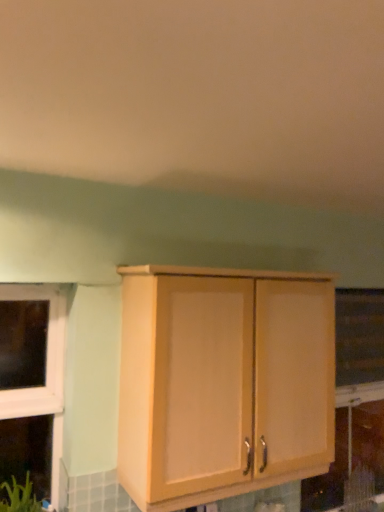
Question: From a real-world perspective, is transparent plastic window screen at right positioned above or below light wood cabinet at center?

Choices:
 (A) above
 (B) below

Answer: (A)

Question: In the image, is transparent plastic window screen at right positioned in front of or behind light wood cabinet at center?

Choices:
 (A) behind
 (B) front

Answer: (A)

Question: Based on their positions, is transparent plastic window screen at right located to the left or right of light wood cabinet at center?

Choices:
 (A) right
 (B) left

Answer: (A)

Question: Choose the correct answer: Is light wood cabinet at center inside transparent plastic window screen at right or outside it?

Choices:
 (A) outside
 (B) inside

Answer: (A)

Question: Considering the relative positions of light wood cabinet at center and transparent plastic window screen at right in the image provided, is light wood cabinet at center to the left or to the right of transparent plastic window screen at right?

Choices:
 (A) right
 (B) left

Answer: (B)

Question: From their relative heights in the image, would you say light wood cabinet at center is taller or shorter than transparent plastic window screen at right?

Choices:
 (A) short
 (B) tall

Answer: (B)

Question: From a real-world perspective, is light wood cabinet at center physically located above or below transparent plastic window screen at right?

Choices:
 (A) below
 (B) above

Answer: (A)